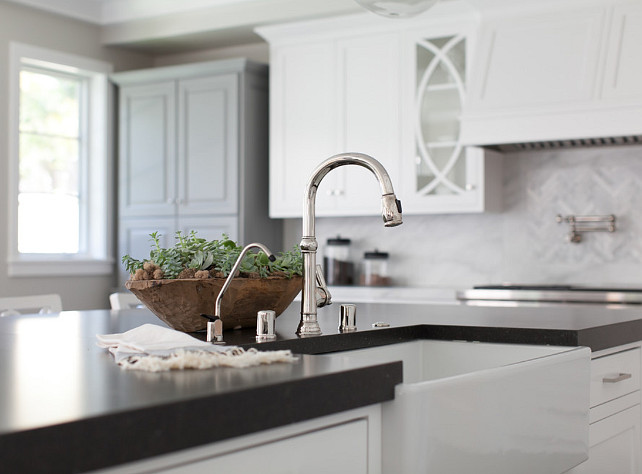
Where is `coco bowl`? coco bowl is located at coordinates (189, 307).